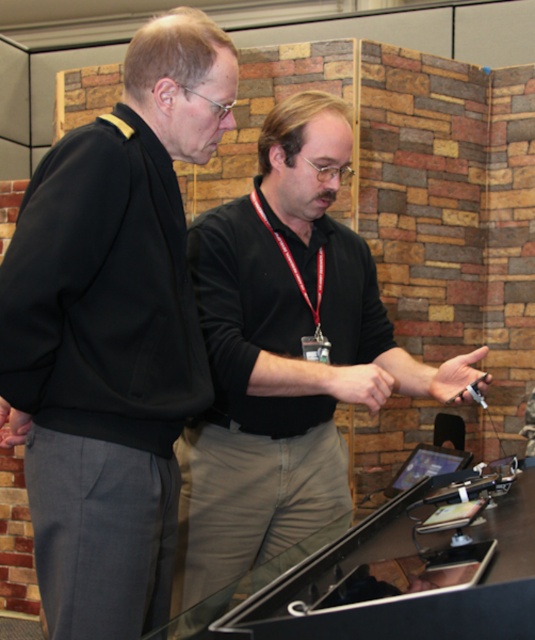
Question: Can you confirm if black matte jacket at left is thinner than black matte shirt at center?

Choices:
 (A) yes
 (B) no

Answer: (A)

Question: Does black matte jacket at left have a larger size compared to black matte shirt at center?

Choices:
 (A) yes
 (B) no

Answer: (B)

Question: Which point appears closest to the camera in this image?

Choices:
 (A) (156, 540)
 (B) (194, 595)

Answer: (A)

Question: Is black matte jacket at left closer to the viewer compared to black matte shirt at center?

Choices:
 (A) no
 (B) yes

Answer: (B)

Question: Which of the following is the closest to the observer?

Choices:
 (A) (90, 301)
 (B) (338, 513)

Answer: (A)